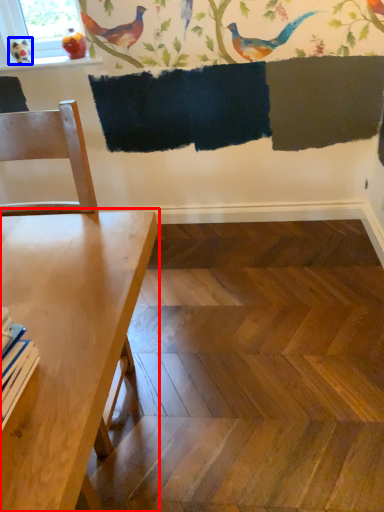
Question: Which object appears closest to the camera in this image, table (highlighted by a red box) or bird (highlighted by a blue box)?

Choices:
 (A) table
 (B) bird

Answer: (A)